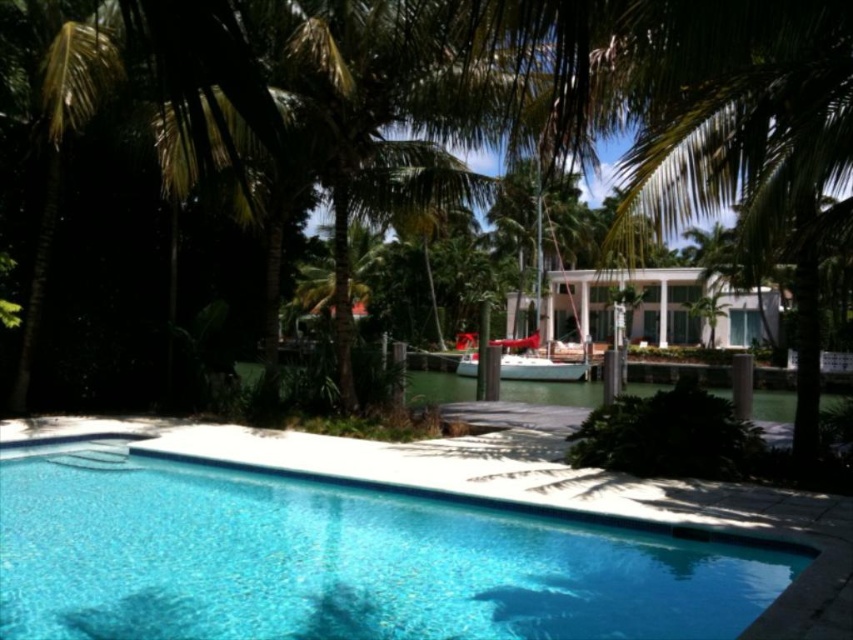
Question: Is clear glass pool at center to the left of red plastic boat at center from the viewer's perspective?

Choices:
 (A) yes
 (B) no

Answer: (A)

Question: Is green leafy palm tree at center positioned before red plastic boat at center?

Choices:
 (A) yes
 (B) no

Answer: (A)

Question: Does clear glass pool at center appear under red plastic boat at center?

Choices:
 (A) no
 (B) yes

Answer: (B)

Question: Which point is farther to the camera?

Choices:
 (A) clear glass pool at center
 (B) red plastic boat at center
 (C) green leafy palm tree at center

Answer: (B)

Question: Which point is farther to the camera?

Choices:
 (A) (805, 220)
 (B) (248, 529)

Answer: (A)

Question: Based on their relative distances, which object is farther from the green leafy palm tree at center?

Choices:
 (A) clear glass pool at center
 (B) red plastic boat at center

Answer: (B)